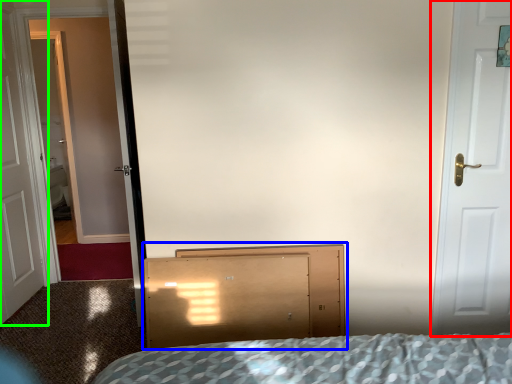
Question: Which object is positioned farthest from door (highlighted by a red box)? Select from dresser (highlighted by a blue box) and door (highlighted by a green box).

Choices:
 (A) dresser
 (B) door

Answer: (B)